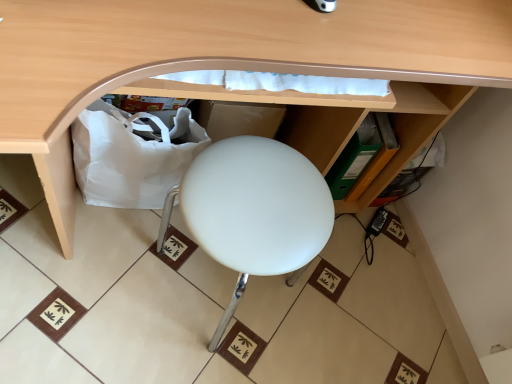
This screenshot has height=384, width=512. What are the coordinates of `unoccupied region to the right of white matte stool at center` in the screenshot? It's located at (335, 314).